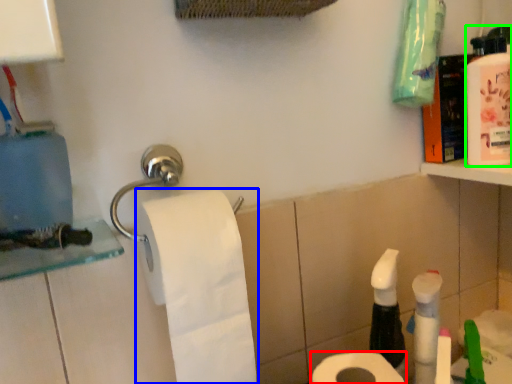
Question: Which is nearer to the toilet paper (highlighted by a red box)? toilet paper (highlighted by a blue box) or mouthwash (highlighted by a green box).

Choices:
 (A) toilet paper
 (B) mouthwash

Answer: (A)